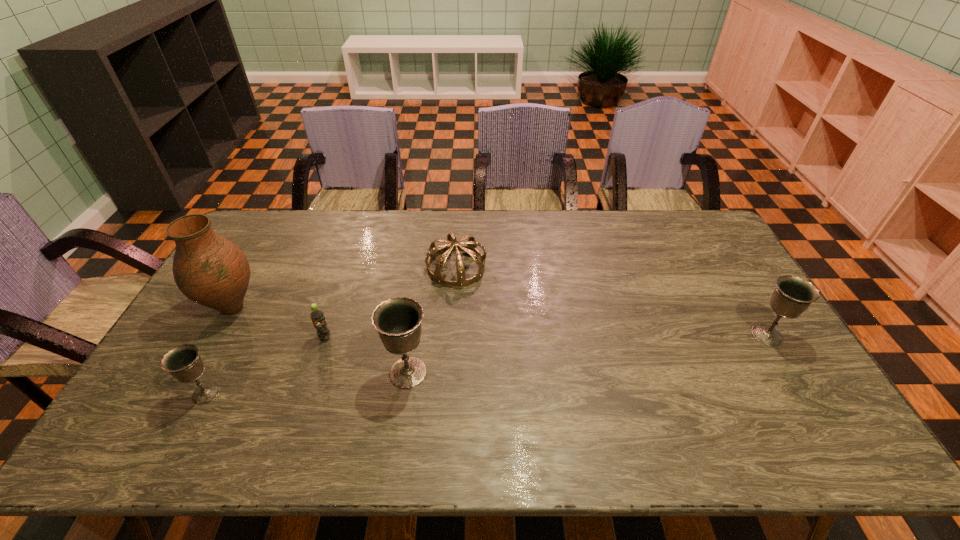
To achieve even spacing by inserting another chalice among them, please point to a vacant spot for this new chalice. Please provide its 2D coordinates. Your answer should be formatted as a tuple, i.e. [(x, y)], where the tuple contains the x and y coordinates of a point satisfying the conditions above.

[(594, 353)]